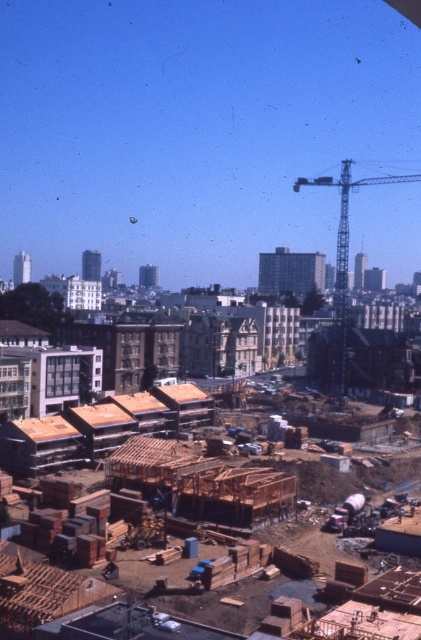
Between wooden frame at center and metallic gray crane at upper right, which one has more height?

With more height is metallic gray crane at upper right.

Can you confirm if wooden frame at center is smaller than metallic gray crane at upper right?

Yes.

Is point (149, 472) farther from viewer compared to point (333, 369)?

That is False.

The width and height of the screenshot is (421, 640). I want to click on wooden frame at center, so click(151, 456).